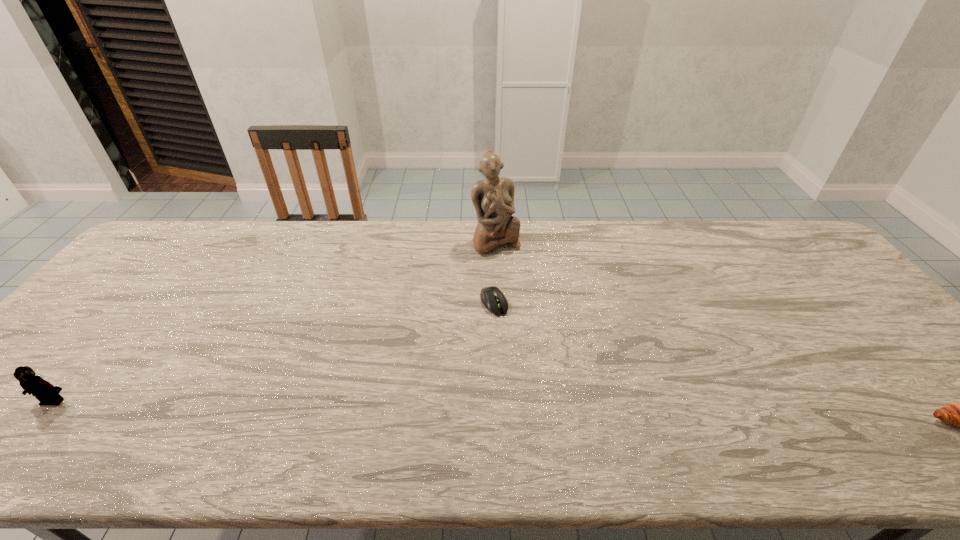
Identify the location of the leftmost object. The width and height of the screenshot is (960, 540). (45, 392).

Where is `the third shortest object`? Image resolution: width=960 pixels, height=540 pixels. the third shortest object is located at coordinates (45, 392).

Find the location of a particular element. This screenshot has height=540, width=960. the second farthest object is located at coordinates (493, 299).

Locate an element on the screen. The width and height of the screenshot is (960, 540). the shortest object is located at coordinates (493, 299).

I want to click on the farthest object, so click(x=493, y=198).

Identify the location of figurine. (493, 198).

You are a GUI agent. You are given a task and a screenshot of the screen. Output one action in this format:
    pyautogui.click(x=<x>, y=<y>)
    Task: Click on the vacant space located on the wheel side of the computer mouse
    The width and height of the screenshot is (960, 540).
    Given the screenshot: What is the action you would take?
    pyautogui.click(x=548, y=398)

The height and width of the screenshot is (540, 960). Identify the location of vacant space located on the wheel side of the computer mouse. (518, 348).

The image size is (960, 540). In order to click on vacant space situated 0.280m on the wheel side of the computer mouse in this screenshot , I will do pyautogui.click(x=548, y=398).

Where is `free region located on the front-facing side of the farthest object`? This screenshot has width=960, height=540. free region located on the front-facing side of the farthest object is located at coordinates (507, 266).